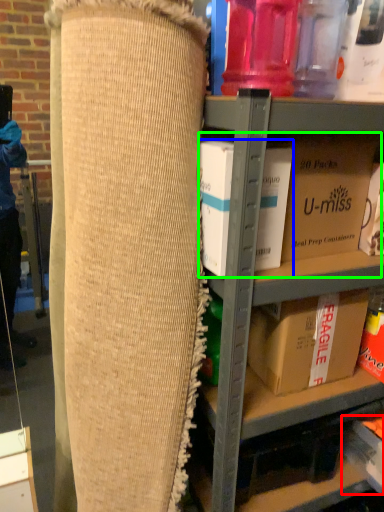
Question: Which is nearer to the storage box (highlighted by a red box)? box (highlighted by a blue box) or storage box (highlighted by a green box).

Choices:
 (A) box
 (B) storage box

Answer: (B)